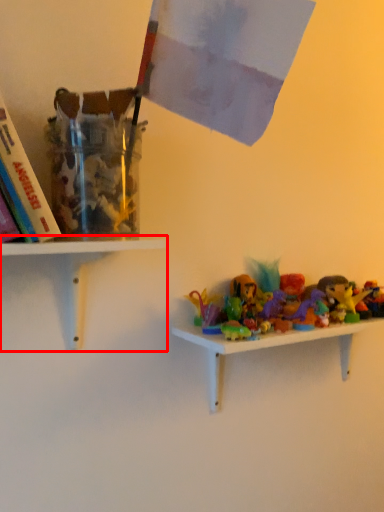
Question: Where is shelf (annotated by the red box) located in relation to shelf in the image?

Choices:
 (A) left
 (B) right

Answer: (A)